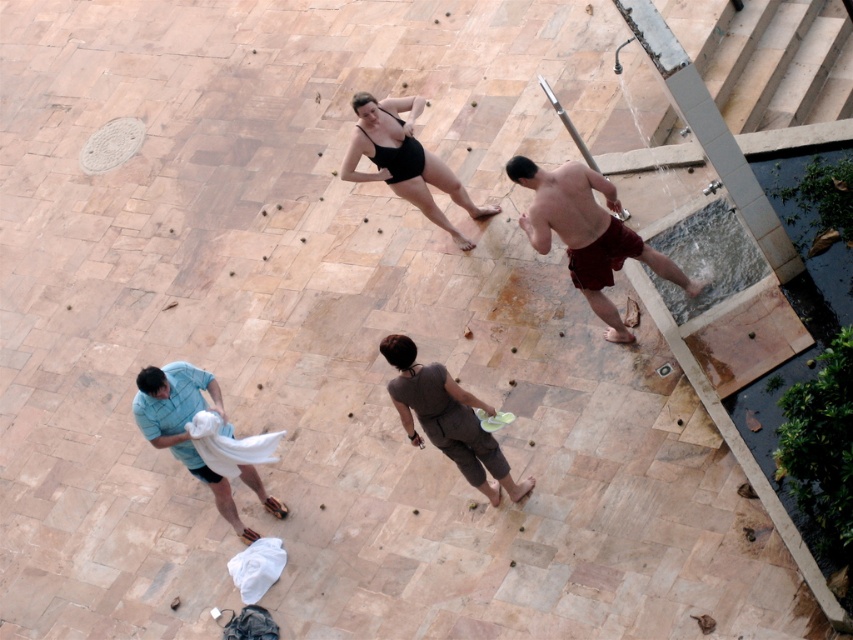
Is dark gray fabric towel at center to the left of black matte swimsuit at center from the viewer's perspective?

Incorrect, dark gray fabric towel at center is not on the left side of black matte swimsuit at center.

Consider the image. Who is lower down, dark gray fabric towel at center or black matte swimsuit at center?

Positioned lower is dark gray fabric towel at center.

This screenshot has width=853, height=640. Describe the element at coordinates (447, 419) in the screenshot. I see `dark gray fabric towel at center` at that location.

Where is `dark gray fabric towel at center`? This screenshot has width=853, height=640. dark gray fabric towel at center is located at coordinates (447, 419).

Is maroon fabric shorts at right taller than dark gray fabric towel at center?

Correct, maroon fabric shorts at right is much taller as dark gray fabric towel at center.

Can you confirm if maroon fabric shorts at right is shorter than dark gray fabric towel at center?

No, maroon fabric shorts at right is not shorter than dark gray fabric towel at center.

Identify the location of maroon fabric shorts at right. This screenshot has width=853, height=640. (587, 234).

Locate an element on the screen. The width and height of the screenshot is (853, 640). maroon fabric shorts at right is located at coordinates 587,234.

Is point (432, 163) more distant than point (178, 387)?

Yes, it is behind point (178, 387).

Can you confirm if black matte swimsuit at center is smaller than blue cotton shirt at lower left?

Actually, black matte swimsuit at center might be larger than blue cotton shirt at lower left.

Who is more forward, (389, 140) or (192, 456)?

Positioned in front is point (192, 456).

At what (x,y) coordinates should I click in order to perform the action: click on black matte swimsuit at center. Please return your answer as a coordinate pair (x, y). This screenshot has height=640, width=853. Looking at the image, I should click on (404, 161).